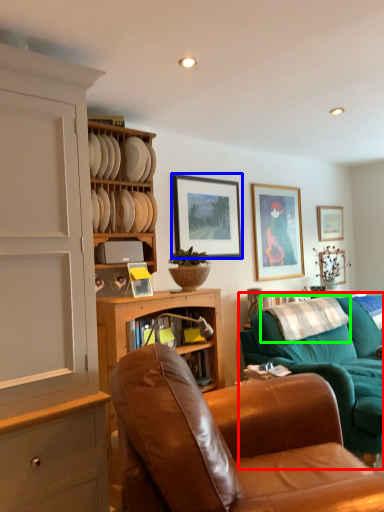
Question: Which object is the farthest from studio couch (highlighted by a red box)? Choose among these: picture frame (highlighted by a blue box) or pillow (highlighted by a green box).

Choices:
 (A) picture frame
 (B) pillow

Answer: (A)